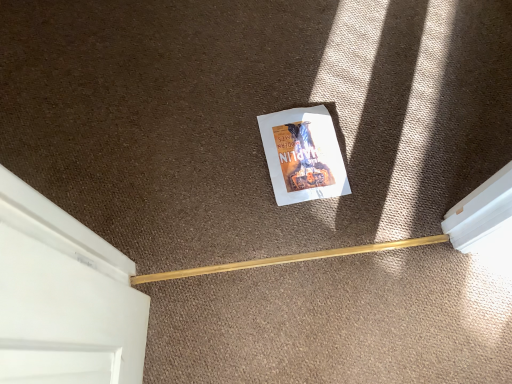
At what (x,y) coordinates should I click in order to perform the action: click on vacant space underneath matte paper book at center (from a real-world perspective). Please return your answer as a coordinate pair (x, y). This screenshot has height=384, width=512. Looking at the image, I should click on (303, 155).